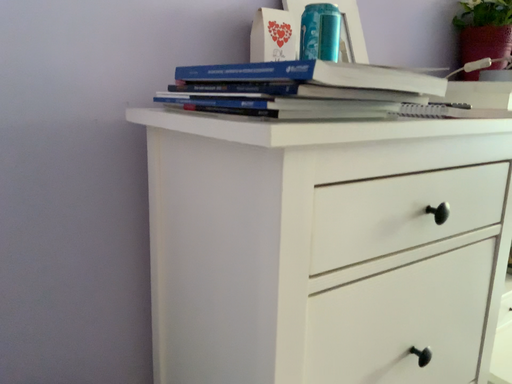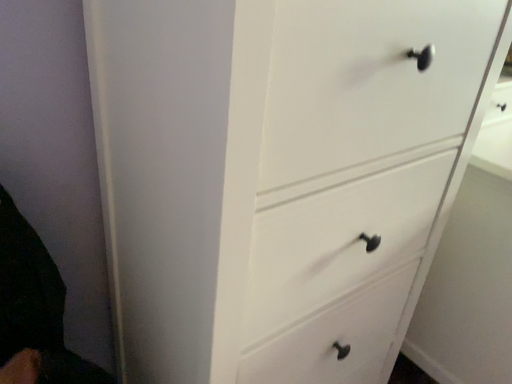
Question: Which way did the camera rotate in the video?

Choices:
 (A) rotated upward
 (B) rotated downward

Answer: (B)